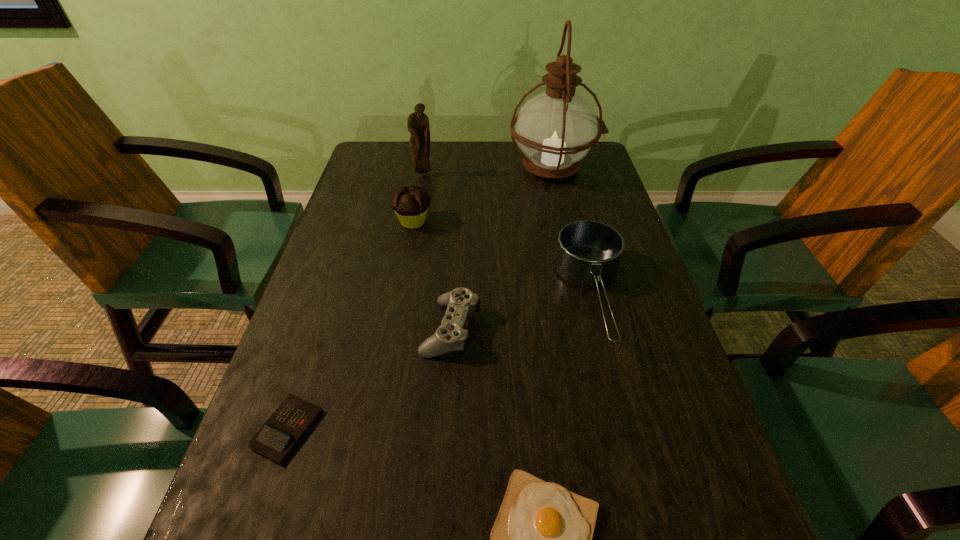
What are the coordinates of `blank area located 0.100m on the front of the muffin` in the screenshot? It's located at (406, 260).

This screenshot has height=540, width=960. I want to click on vacant space situated 0.300m with the handle extending from one side of the saucepan, so click(654, 539).

Locate an element on the screen. free region located on the back of the third shortest object is located at coordinates (455, 260).

This screenshot has width=960, height=540. In order to click on vacant space located 0.230m on the right of the second nearest object in this screenshot , I will do `click(455, 429)`.

Image resolution: width=960 pixels, height=540 pixels. I want to click on oil lamp that is at the far edge, so click(x=557, y=128).

In order to click on figurine located at the far edge in this screenshot , I will do `click(418, 125)`.

Identify the location of muffin that is at the left edge. 410,204.

Where is `calculator that is at the left edge`? The height and width of the screenshot is (540, 960). calculator that is at the left edge is located at coordinates (278, 436).

Find the location of a particular element. The height and width of the screenshot is (540, 960). oil lamp located in the right edge section of the desktop is located at coordinates (557, 128).

I want to click on saucepan at the right edge, so click(x=588, y=254).